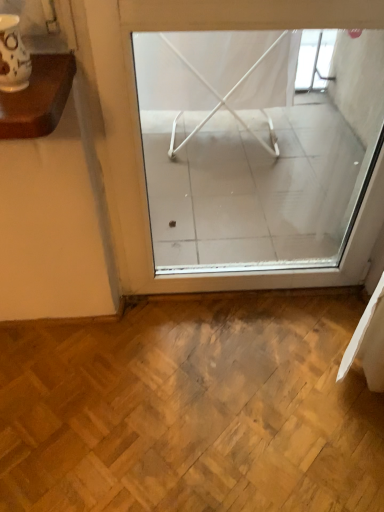
The width and height of the screenshot is (384, 512). I want to click on transparent glass window at center, so click(x=140, y=136).

The width and height of the screenshot is (384, 512). What do you see at coordinates (140, 136) in the screenshot? I see `transparent glass window at center` at bounding box center [140, 136].

Where is `transparent glass window at center`? Image resolution: width=384 pixels, height=512 pixels. transparent glass window at center is located at coordinates (140, 136).